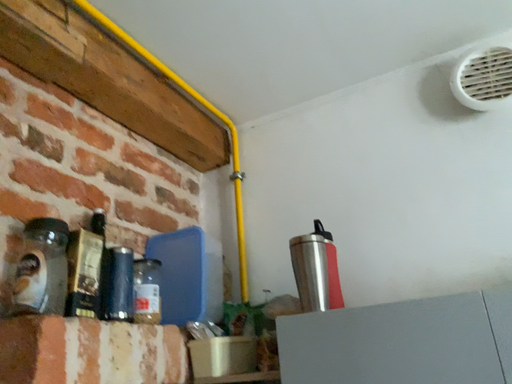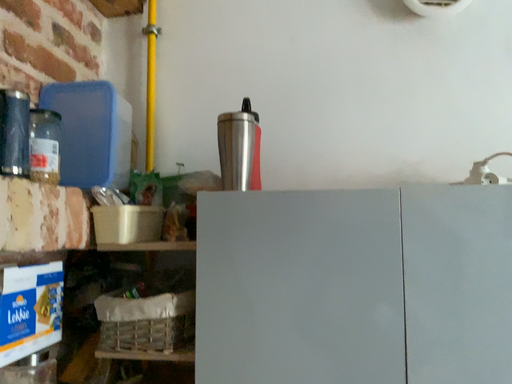
Question: Which way did the camera rotate in the video?

Choices:
 (A) rotated upward
 (B) rotated downward

Answer: (B)